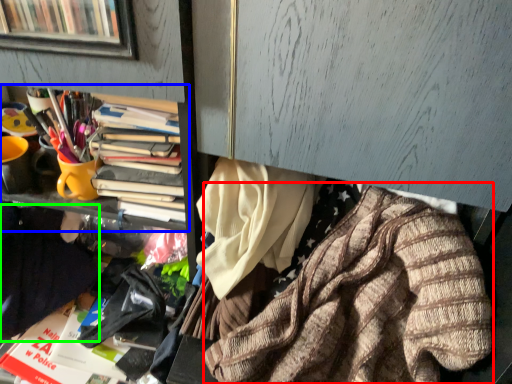
Question: Estimate the real-world distances between objects in this image. Which object is closer to clothing (highlighted by a red box), bookcase (highlighted by a blue box) or clothing (highlighted by a green box)?

Choices:
 (A) bookcase
 (B) clothing

Answer: (A)